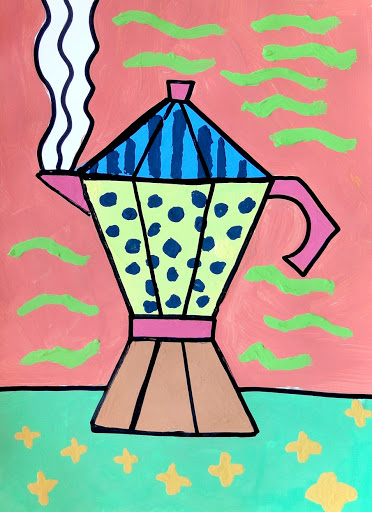
Where is `handle`? Image resolution: width=372 pixels, height=512 pixels. handle is located at coordinates (313, 208).